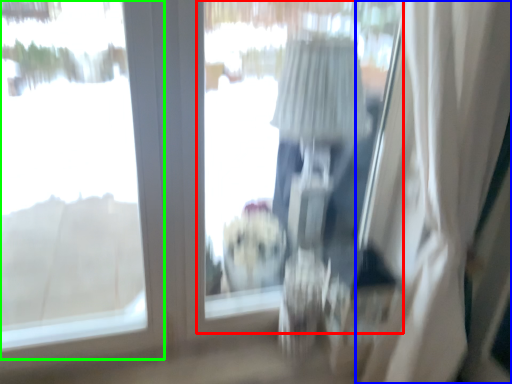
Question: Which object is positioned farthest from window screen (highlighted by a red box)? Select from curtain (highlighted by a blue box) and window (highlighted by a green box).

Choices:
 (A) curtain
 (B) window

Answer: (A)